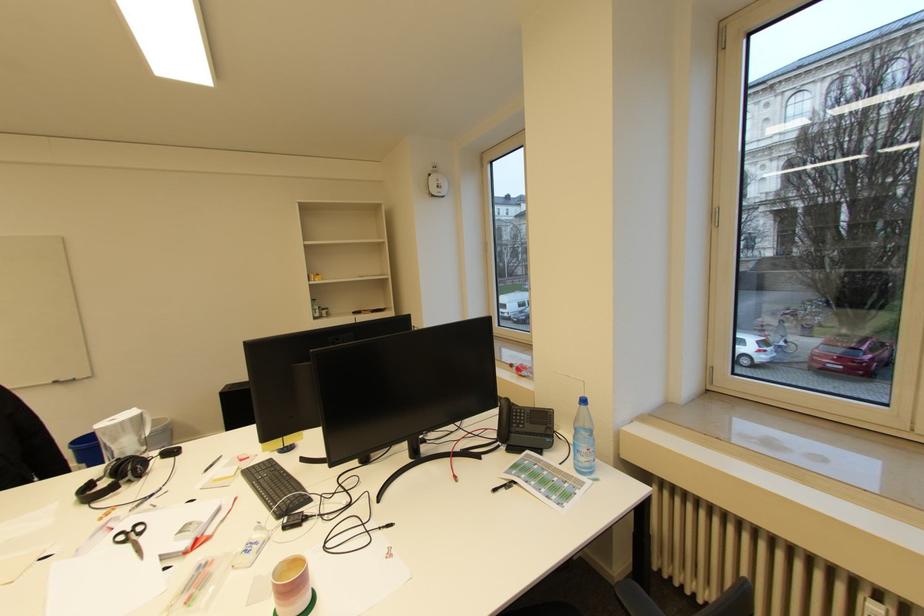
This screenshot has height=616, width=924. I want to click on telephone receiver, so click(508, 411).